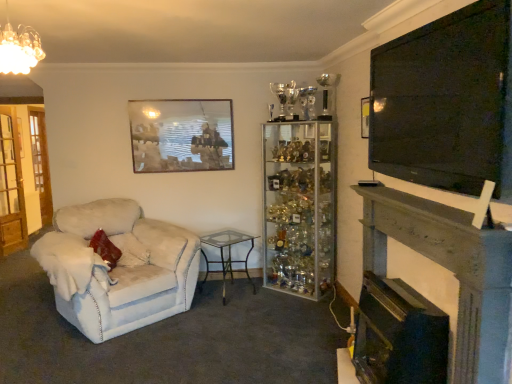
You are a GUI agent. You are given a task and a screenshot of the screen. Output one action in this format:
    pyautogui.click(x=<x>, y=<y>)
    Task: Click on the vacant space situated above wooden picture frame at upper center, which ranks as the first picture frame in back-to-front order (from a real-world perspective)
    The height and width of the screenshot is (384, 512).
    Given the screenshot: What is the action you would take?
    pyautogui.click(x=185, y=95)